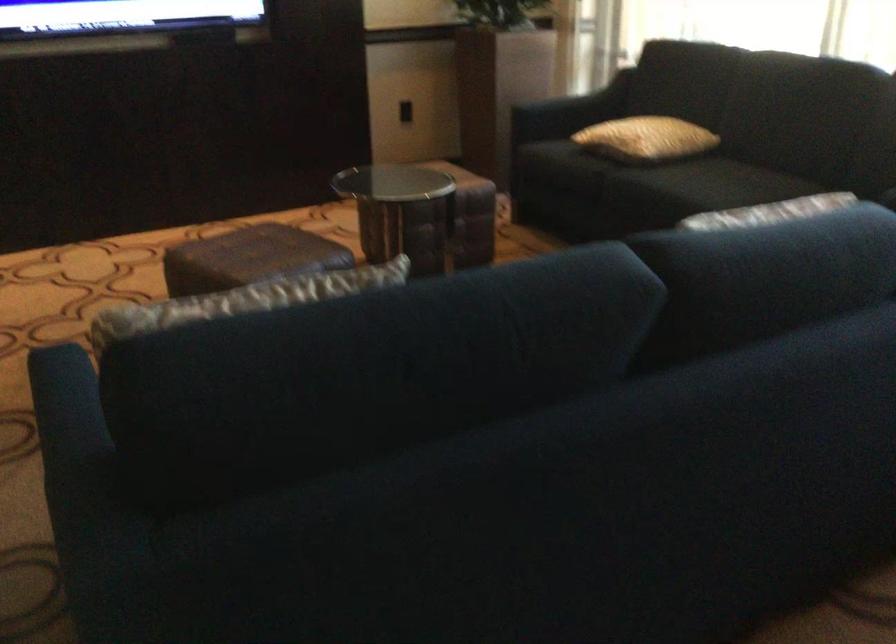
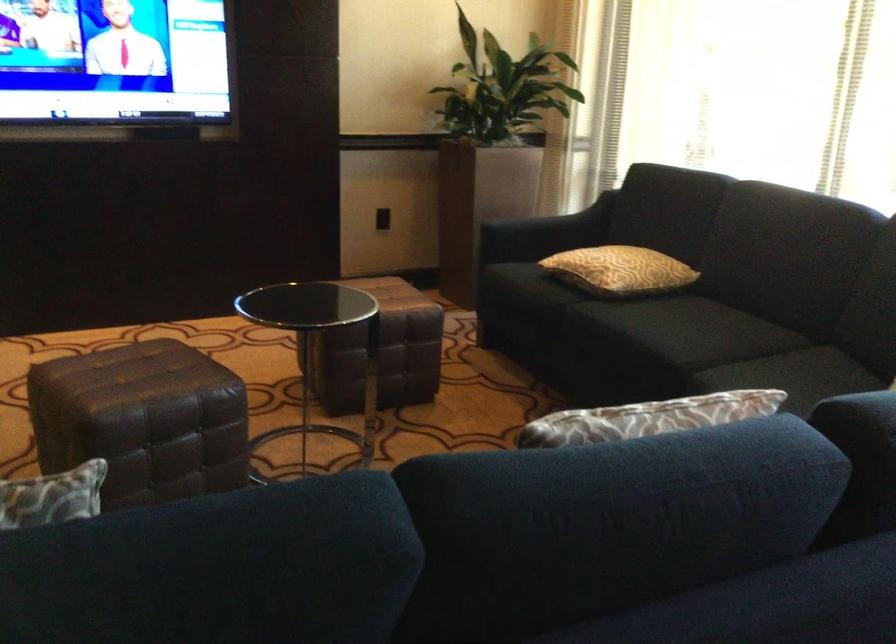
Question: The first image is from the beginning of the video and the second image is from the end. How did the camera likely rotate when shooting the video?

Choices:
 (A) Left
 (B) Right
 (C) Up
 (D) Down

Answer: (C)